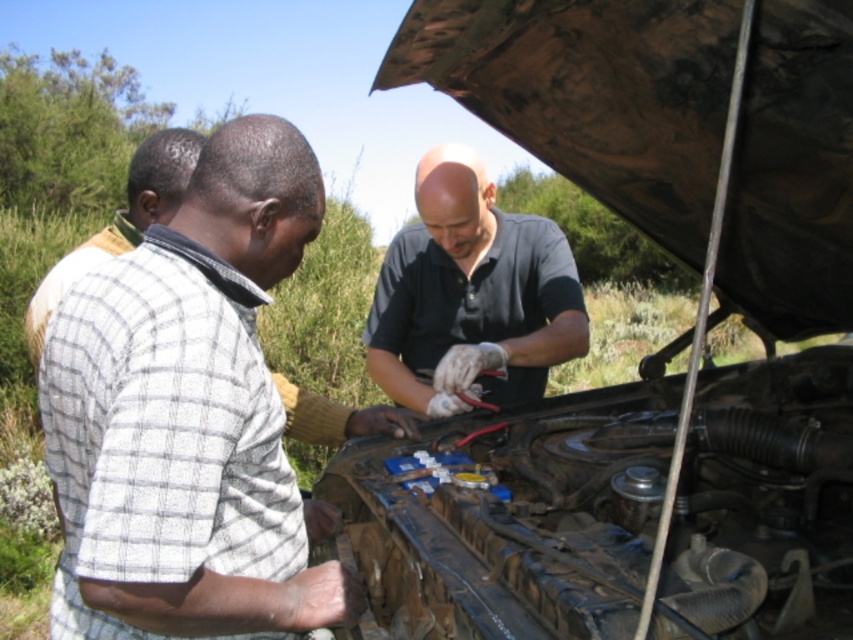
Which is more to the right, white checkered shirt at center or white checkered shirt at left?

white checkered shirt at center is more to the right.

Can you confirm if white checkered shirt at center is smaller than white checkered shirt at left?

Yes.

Find the location of a particular element. This screenshot has height=640, width=853. white checkered shirt at center is located at coordinates (189, 417).

Is rusty metal engine at center to the left of white checkered shirt at center from the viewer's perspective?

In fact, rusty metal engine at center is to the right of white checkered shirt at center.

Is rusty metal engine at center below white checkered shirt at center?

No.

What do you see at coordinates (776, 356) in the screenshot? Image resolution: width=853 pixels, height=640 pixels. I see `rusty metal engine at center` at bounding box center [776, 356].

Identify the location of rusty metal engine at center. The height and width of the screenshot is (640, 853). (776, 356).

Locate an element on the screen. The image size is (853, 640). rusty metal engine at center is located at coordinates (776, 356).

Find the location of a particular element. The height and width of the screenshot is (640, 853). rusty metal engine at center is located at coordinates (776, 356).